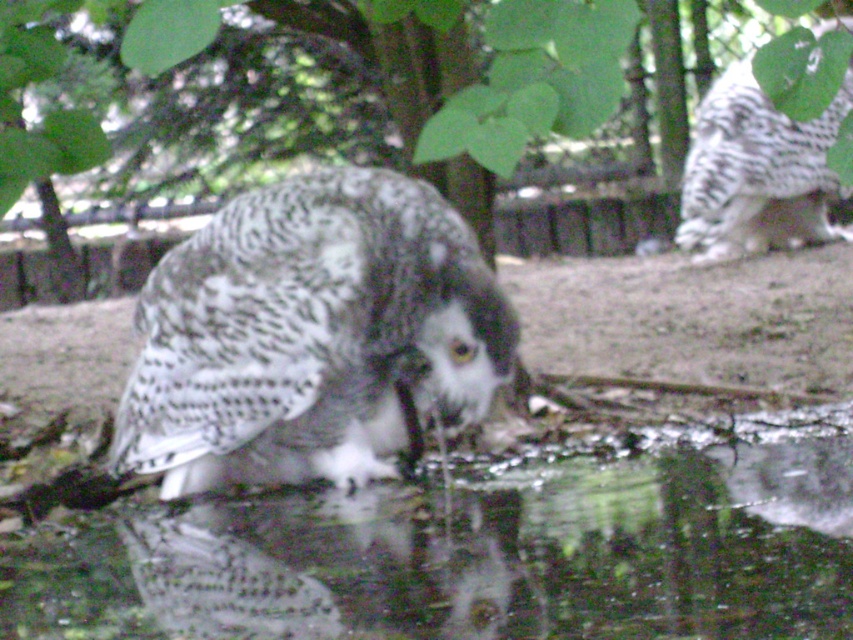
You are a zookeeper observing the snowy owls in their enclosure. You notice the speckled feathered owl at center and the white speckled owl at upper right. Which owl would you need to look up to see?

The white speckled owl at upper right is taller than the speckled feathered owl at center, so you would need to look up to see the white speckled owl at upper right.

You are a visitor at the zoo and want to take a photo of the white speckled owl at upper right. You notice a green leafy tree at center in the way. Based on their positions, will the tree block your view of the owl?

The green leafy tree at center is below the white speckled owl at upper right, so the tree will not block your view of the owl since it is positioned lower.